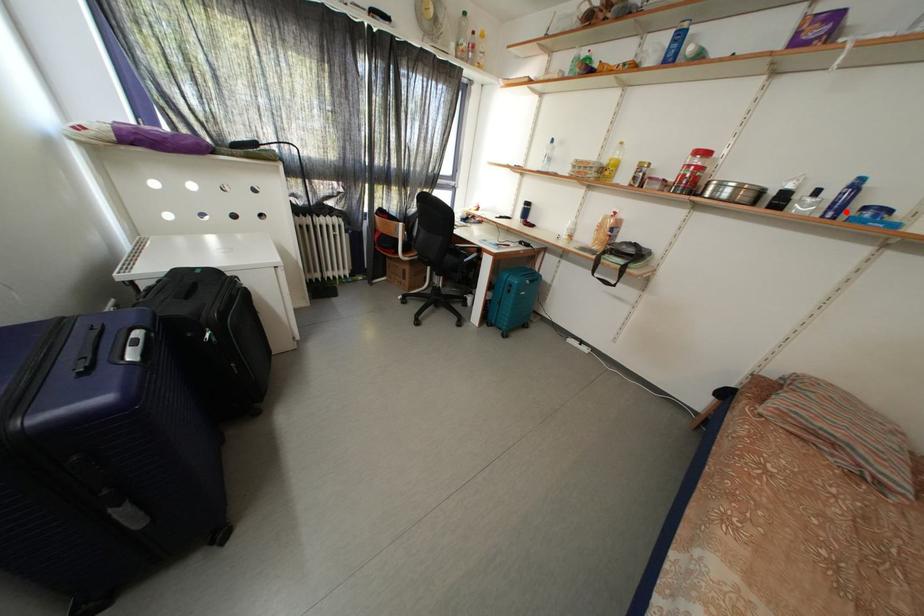
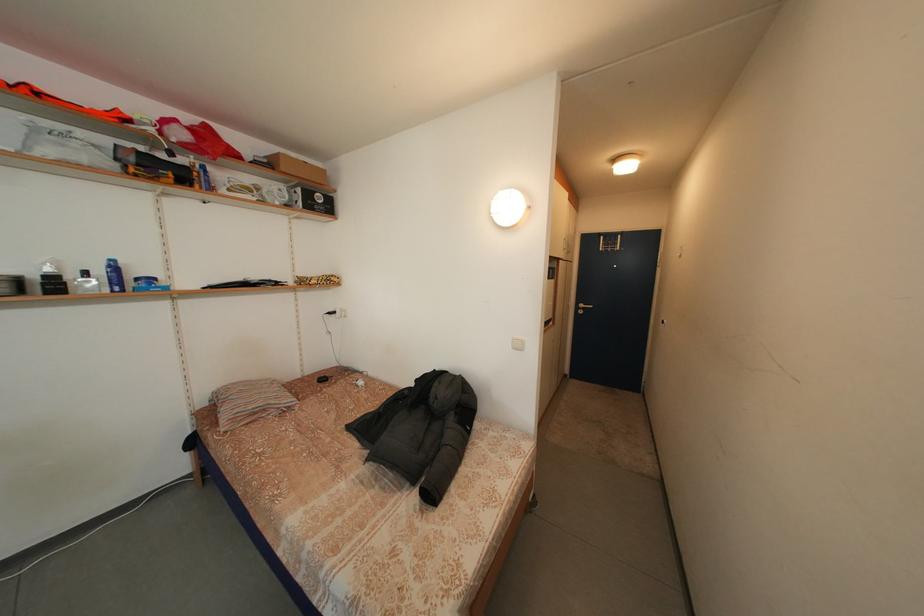
Where in the second image is the point corresponding to the highlighted location from the first image?

(125, 286)